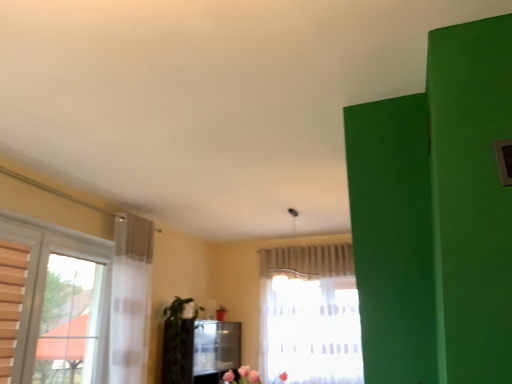
What is the approximate height of white sheer curtain at center?

The height of white sheer curtain at center is 16.33 inches.

What do you see at coordinates (308, 261) in the screenshot? This screenshot has height=384, width=512. I see `white sheer curtain at center` at bounding box center [308, 261].

I want to click on white sheer curtain at center, so point(308,261).

Measure the distance between green matte plant at lower left and camera.

green matte plant at lower left and camera are 4.16 meters apart.

What do you see at coordinates (176, 342) in the screenshot? I see `green matte plant at lower left` at bounding box center [176, 342].

Measure the distance between point (175, 364) and camera.

Point (175, 364) and camera are 4.20 meters apart from each other.

Identify the location of green matte plant at lower left. (176, 342).

Locate an element on the screen. This screenshot has width=512, height=384. white sheer curtain at center is located at coordinates point(308,261).

Does green matte plant at lower left appear on the left side of white sheer curtain at center?

Yes, green matte plant at lower left is to the left of white sheer curtain at center.

Which object is further away from the camera taking this photo, green matte plant at lower left or white sheer curtain at center?

white sheer curtain at center is further from the camera.

Between point (164, 373) and point (281, 255), which one is positioned behind?

Point (281, 255)

From the image's perspective, who appears lower, green matte plant at lower left or white sheer curtain at center?

green matte plant at lower left, from the image's perspective.

From a real-world perspective, between green matte plant at lower left and white sheer curtain at center, who is vertically lower?

green matte plant at lower left is physically lower.

Is green matte plant at lower left wider or thinner than white sheer curtain at center?

Considering their sizes, green matte plant at lower left looks broader than white sheer curtain at center.

Considering the sizes of green matte plant at lower left and white sheer curtain at center in the image, is green matte plant at lower left taller or shorter than white sheer curtain at center?

Considering their sizes, green matte plant at lower left has more height than white sheer curtain at center.

Can you confirm if green matte plant at lower left is smaller than white sheer curtain at center?

Incorrect, green matte plant at lower left is not smaller in size than white sheer curtain at center.

Is white sheer curtain at center located within green matte plant at lower left?

No, white sheer curtain at center is not surrounded by green matte plant at lower left.

Is green matte plant at lower left next to white sheer curtain at center?

They are not placed beside each other.

Is green matte plant at lower left facing towards white sheer curtain at center?

No, green matte plant at lower left is not facing towards white sheer curtain at center.

I want to click on curtain behind the green matte plant at lower left, so click(308, 261).

Can you confirm if white sheer curtain at center is positioned to the left of green matte plant at lower left?

In fact, white sheer curtain at center is to the right of green matte plant at lower left.

Does white sheer curtain at center lie in front of green matte plant at lower left?

No, it is behind green matte plant at lower left.

Considering the points (306, 275) and (176, 381), which point is in front, point (306, 275) or point (176, 381)?

The point (176, 381) is closer.

From the image's perspective, which one is positioned higher, white sheer curtain at center or green matte plant at lower left?

white sheer curtain at center appears higher in the image.

From a real-world perspective, is white sheer curtain at center over green matte plant at lower left?

Correct, in the physical world, white sheer curtain at center is higher than green matte plant at lower left.

Considering the sizes of objects white sheer curtain at center and green matte plant at lower left in the image provided, who is thinner, white sheer curtain at center or green matte plant at lower left?

white sheer curtain at center is thinner.

Between white sheer curtain at center and green matte plant at lower left, which one has more height?

Standing taller between the two is green matte plant at lower left.

Is white sheer curtain at center bigger than green matte plant at lower left?

No, white sheer curtain at center is not bigger than green matte plant at lower left.

Is white sheer curtain at center positioned beyond the bounds of green matte plant at lower left?

white sheer curtain at center lies outside green matte plant at lower left's area.

Is white sheer curtain at center beside green matte plant at lower left?

No, white sheer curtain at center is not making contact with green matte plant at lower left.

In the scene shown: Is white sheer curtain at center oriented away from green matte plant at lower left?

white sheer curtain at center is not turned away from green matte plant at lower left.

Where is `curtain above the green matte plant at lower left (from the image's perspective)`? This screenshot has height=384, width=512. curtain above the green matte plant at lower left (from the image's perspective) is located at coordinates (308, 261).

Locate an element on the screen. The image size is (512, 384). plant to the left of white sheer curtain at center is located at coordinates (176, 342).

Where is `curtain above the green matte plant at lower left (from a real-world perspective)`? This screenshot has height=384, width=512. curtain above the green matte plant at lower left (from a real-world perspective) is located at coordinates (308, 261).